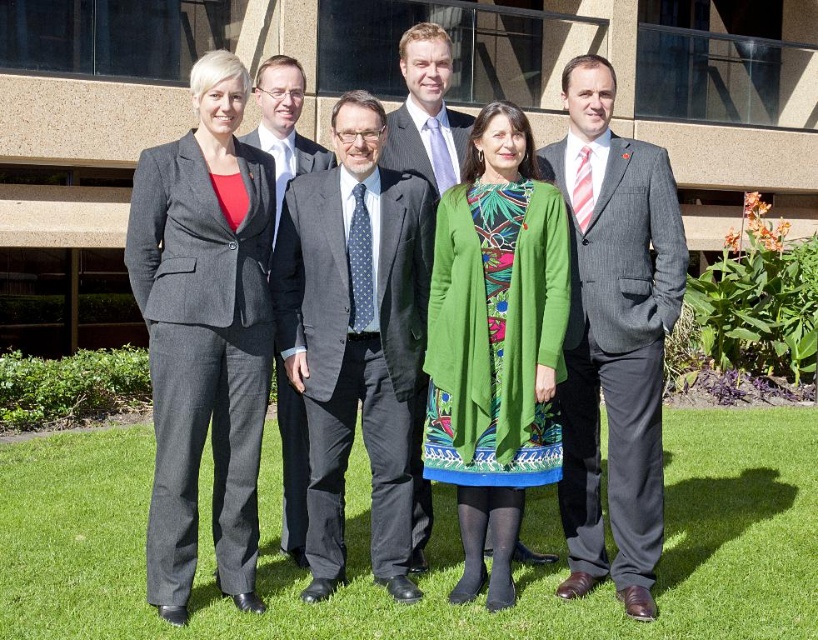
Question: Which object is the closest to the matte gray suit at center?

Choices:
 (A) matte black suit at center
 (B) green textured dress at center
 (C) green grass at lower center

Answer: (A)

Question: Which of the following is the farthest from the observer?

Choices:
 (A) (396, 118)
 (B) (448, 156)
 (C) (306, 272)
 (D) (495, 492)

Answer: (A)

Question: Is green grass at lower center wider than green textured dress at center?

Choices:
 (A) yes
 (B) no

Answer: (A)

Question: Which object is farther from the camera taking this photo?

Choices:
 (A) green textured dress at center
 (B) dark gray suit at center
 (C) green grass at lower center

Answer: (B)

Question: Does gray pinstripe suit at center have a lesser width compared to gray woolen suit at left?

Choices:
 (A) yes
 (B) no

Answer: (B)

Question: Is green textured dress at center positioned in front of polished gray suit at center?

Choices:
 (A) no
 (B) yes

Answer: (B)